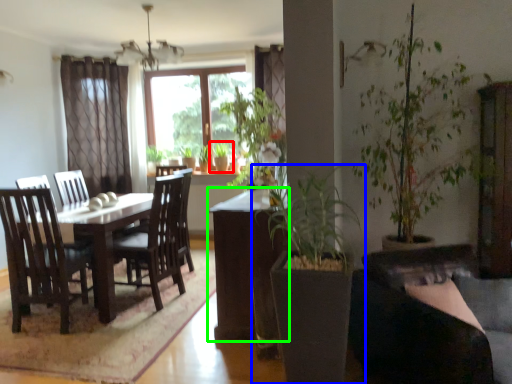
Question: Which is farther away from houseplant (highlighted by a red box)? houseplant (highlighted by a blue box) or table (highlighted by a green box)?

Choices:
 (A) houseplant
 (B) table

Answer: (A)